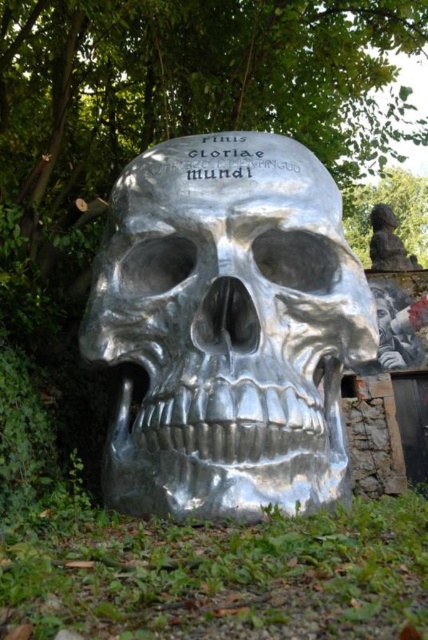
Question: Can you confirm if green leafy tree at upper center is positioned above satin silver skull at center?

Choices:
 (A) yes
 (B) no

Answer: (A)

Question: Is the position of shiny metallic skull at center more distant than that of green leafy tree at upper center?

Choices:
 (A) no
 (B) yes

Answer: (A)

Question: Which point is farther from the camera taking this photo?

Choices:
 (A) (249, 275)
 (B) (369, 212)

Answer: (B)

Question: Estimate the real-world distances between objects in this image. Which object is farther from the green leafy tree at upper center?

Choices:
 (A) satin silver skull at center
 (B) shiny metallic skull at center

Answer: (B)

Question: Estimate the real-world distances between objects in this image. Which object is farther from the shiny metallic skull at center?

Choices:
 (A) satin silver skull at center
 (B) green leafy tree at upper center

Answer: (B)

Question: Does green leafy tree at upper center appear over satin silver skull at center?

Choices:
 (A) yes
 (B) no

Answer: (A)